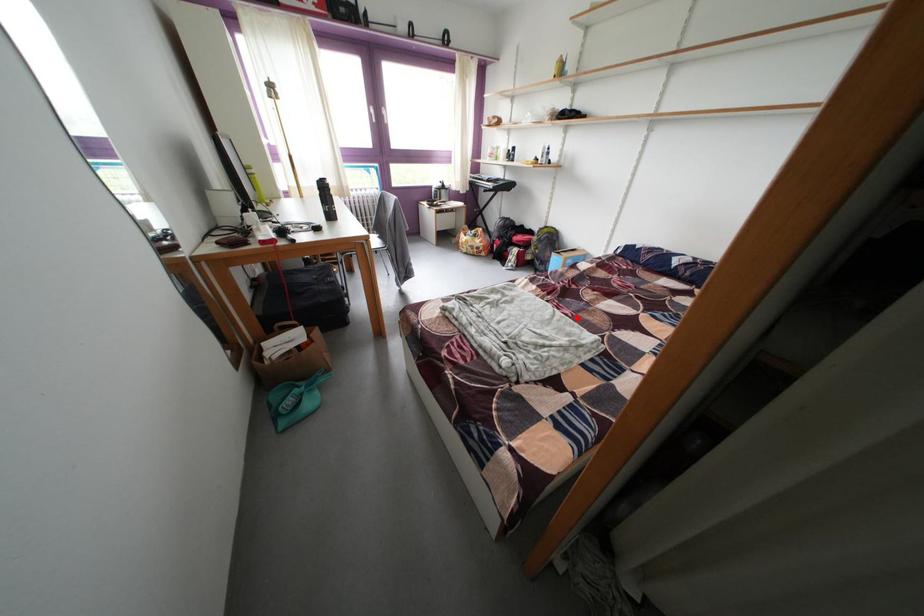
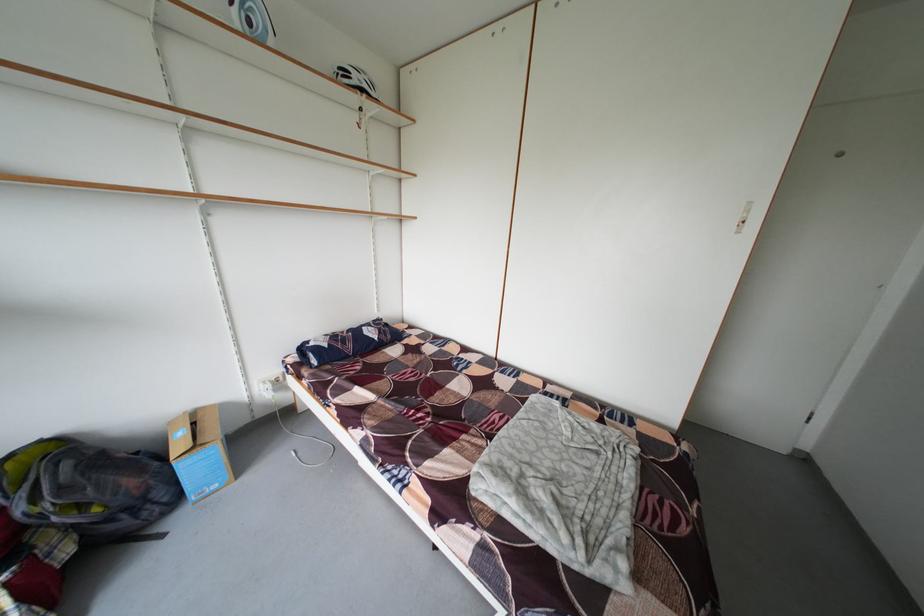
In the second image, find the point that corresponds to the highlighted location in the first image.

(506, 422)